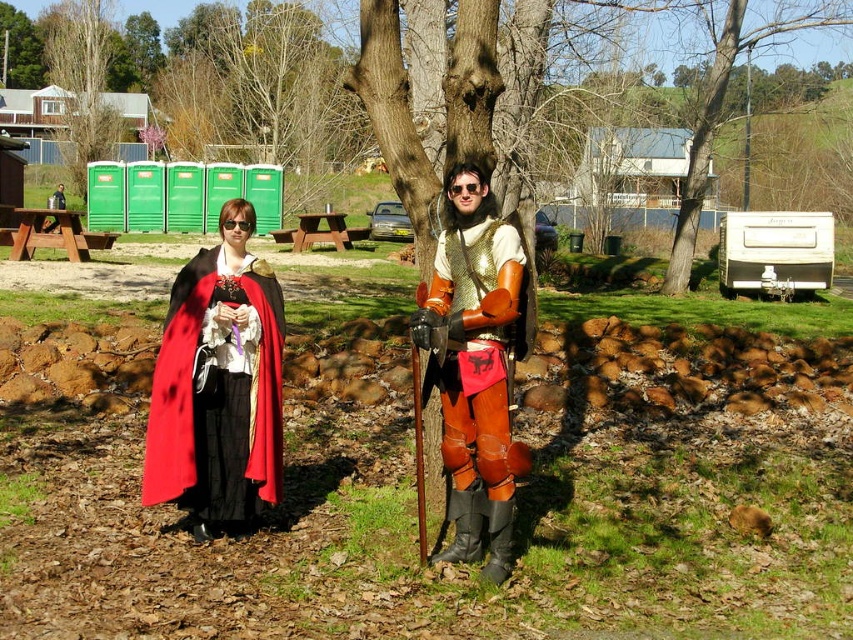
In the scene shown: Who is higher up, matte black cape at center or leather armor at center?

leather armor at center is higher up.

Can you confirm if matte black cape at center is positioned below leather armor at center?

Indeed, matte black cape at center is positioned under leather armor at center.

Is point (190, 417) positioned after point (511, 484)?

Yes, point (190, 417) is behind point (511, 484).

The width and height of the screenshot is (853, 640). I want to click on matte black cape at center, so click(x=218, y=385).

From the picture: Can you confirm if leather armor at center is shorter than smooth white trailer at right?

Yes.

Between leather armor at center and smooth white trailer at right, which one has less height?

Standing shorter between the two is leather armor at center.

Who is more distant from viewer, (485, 291) or (712, 76)?

The point (712, 76) is behind.

Where is `leather armor at center`? leather armor at center is located at coordinates (474, 365).

Is matte black cape at center below smooth white trailer at right?

Yes.

What do you see at coordinates (218, 385) in the screenshot? I see `matte black cape at center` at bounding box center [218, 385].

Does point (241, 406) come behind point (741, 0)?

No.

The image size is (853, 640). What are the coordinates of `matte black cape at center` in the screenshot? It's located at (218, 385).